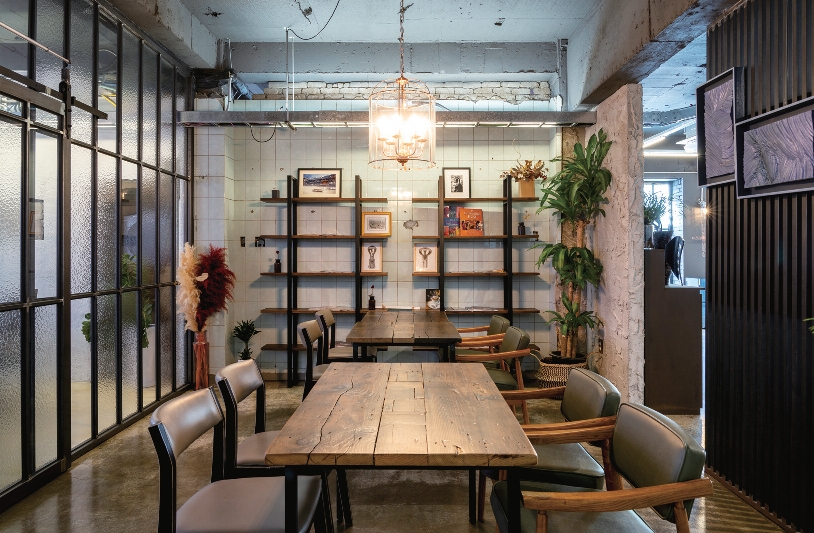
I want to click on wooden shelves, so click(330, 199), click(318, 233), click(326, 272), click(339, 306), click(300, 345), click(300, 373), click(479, 197), click(484, 234), click(492, 272), click(480, 309).